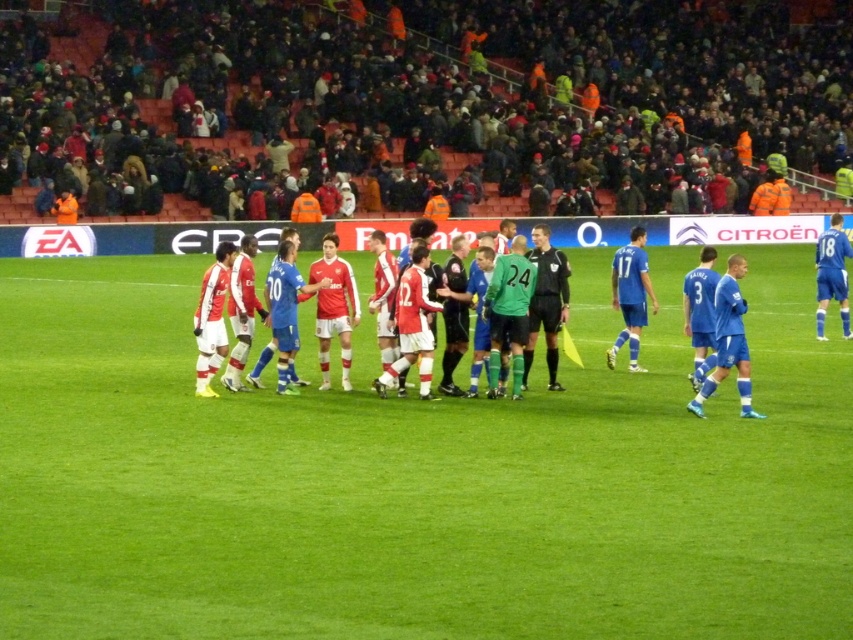
You are a photographer at the edge of the field. You need to capture a photo that includes both the matte red jersey at center and the blue smooth jersey at right. Based on their positions, which jersey will appear higher in the photo?

The matte red jersey at center appears higher in the photo because it is positioned above the blue smooth jersey at right.

From the picture: You are a photographer positioned at the edge of the field. You want to take a photo that includes both the matte red jersey at center and the blue smooth jersey at right. Based on their positions, which jersey should you adjust your camera to focus on first to ensure both are in frame?

The matte red jersey at center is to the left of the blue smooth jersey at right. Since you want both in frame, focus on the matte red jersey at center first as it is positioned further left, allowing you to adjust the camera to include both from left to right.

You are a photographer positioned at the edge of the field. You need to capture a photo that includes both the black jersey at center and the blue smooth jersey at right. Based on their positions and sizes, which jersey should you focus on first to ensure both are in frame?

The black jersey at center is taller than the blue smooth jersey at right, so you should focus on the black jersey at center first to ensure both are in frame.